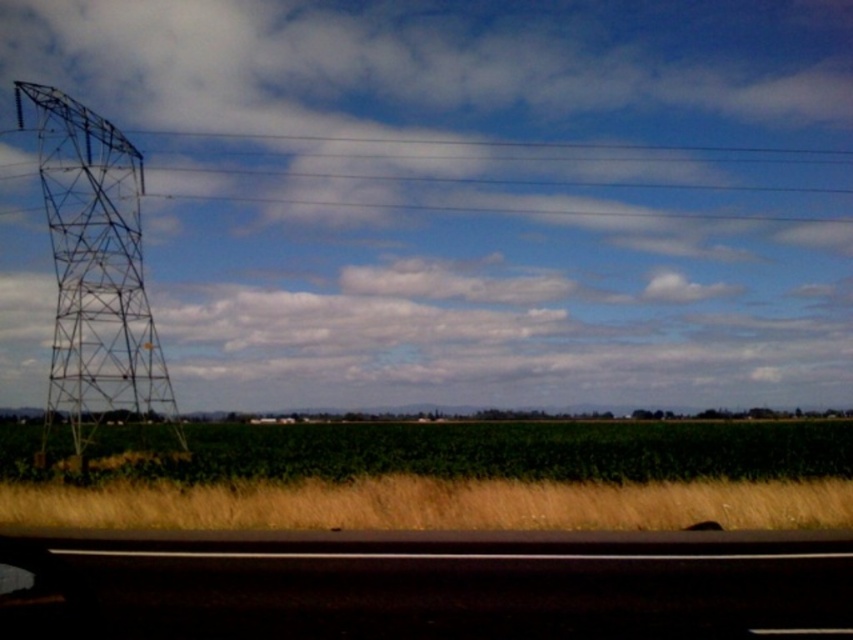
Is black asphalt highway at lower center above yellow grass at lower center?

Yes, black asphalt highway at lower center is above yellow grass at lower center.

This screenshot has width=853, height=640. What do you see at coordinates (424, 584) in the screenshot?
I see `black asphalt highway at lower center` at bounding box center [424, 584].

Does point (467, 554) lie behind point (166, 506)?

No, it is in front of (166, 506).

I want to click on black asphalt highway at lower center, so click(x=424, y=584).

Is yellow grass at lower center to the right of metallic grid tower at left from the viewer's perspective?

Correct, you'll find yellow grass at lower center to the right of metallic grid tower at left.

Does point (386, 484) come closer to viewer compared to point (155, 394)?

Yes.

The image size is (853, 640). I want to click on yellow grass at lower center, so click(433, 504).

Does black asphalt highway at lower center appear on the left side of metallic grid tower at left?

In fact, black asphalt highway at lower center is to the right of metallic grid tower at left.

Does black asphalt highway at lower center have a lesser width compared to metallic grid tower at left?

Correct, black asphalt highway at lower center's width is less than metallic grid tower at left's.

Is point (260, 561) farther from camera compared to point (136, 394)?

No, it is in front of (136, 394).

The image size is (853, 640). Find the location of `black asphalt highway at lower center`. black asphalt highway at lower center is located at coordinates (424, 584).